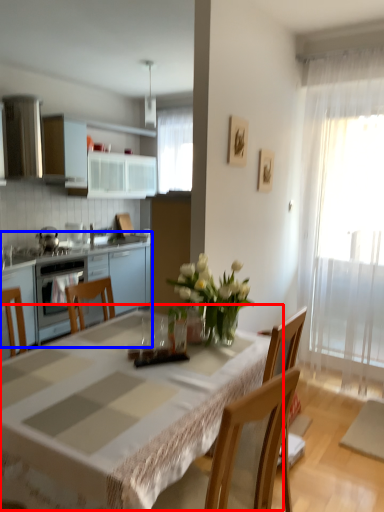
Question: Among these objects, which one is farthest to the camera, table (highlighted by a red box) or cabinetry (highlighted by a blue box)?

Choices:
 (A) table
 (B) cabinetry

Answer: (B)